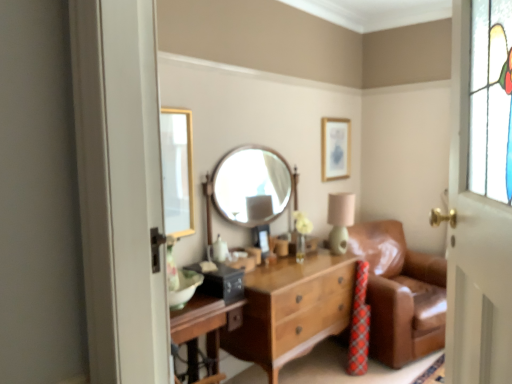
You are a GUI agent. You are given a task and a screenshot of the screen. Output one action in this format:
    pyautogui.click(x=<x>, y=<y>)
    Task: Click on the free location to the left of matte green table lamp at center
    Image resolution: width=512 pixels, height=384 pixels.
    Given the screenshot: What is the action you would take?
    pyautogui.click(x=314, y=257)